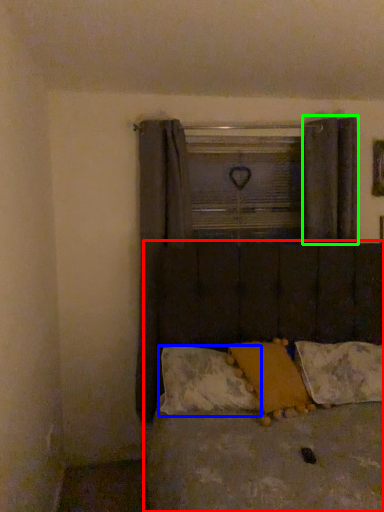
Question: Considering the real-world distances, which object is closest to bed (highlighted by a red box)? pillow (highlighted by a blue box) or curtain (highlighted by a green box).

Choices:
 (A) pillow
 (B) curtain

Answer: (A)